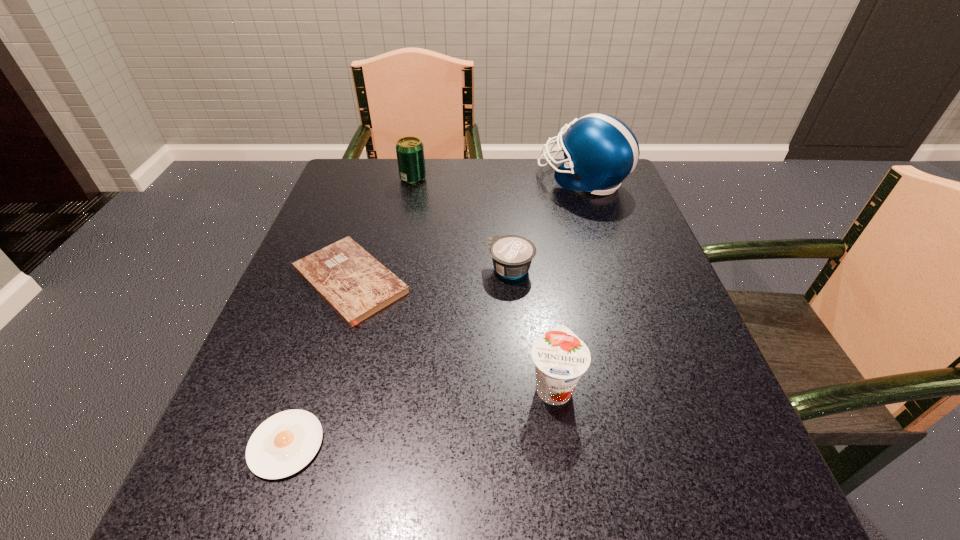
Find the location of a particular element. Image resolution: width=960 pixels, height=540 pixels. vacant area that lies between the shorter yogurt and the taller yogurt is located at coordinates (532, 328).

Image resolution: width=960 pixels, height=540 pixels. I want to click on object that stands as the closest to the fourth tallest object, so click(351, 281).

Point out which object is positioned as the nearest to the football helmet. Please provide its 2D coordinates. Your answer should be formatted as a tuple, i.e. [(x, y)], where the tuple contains the x and y coordinates of a point satisfying the conditions above.

[(512, 255)]

In order to click on free space that satisfies the following two spatial constraints: 1. at the front of the tallest object with the faceguard; 2. on the front side of the Bible in this screenshot , I will do `click(615, 281)`.